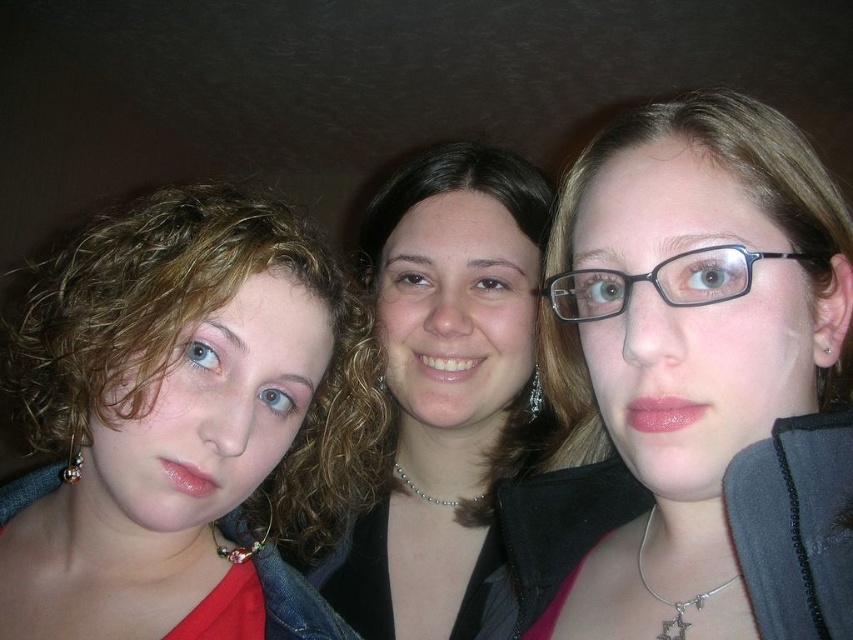
Question: Can you confirm if matte black glasses at center is positioned above black plastic glasses at center?

Choices:
 (A) no
 (B) yes

Answer: (A)

Question: Which object is positioned closest to the black plastic glasses at center?

Choices:
 (A) matte red shirt at left
 (B) matte black glasses at center

Answer: (B)

Question: Is matte black glasses at center positioned before matte red shirt at left?

Choices:
 (A) yes
 (B) no

Answer: (A)

Question: Considering the real-world distances, which object is closest to the matte black glasses at center?

Choices:
 (A) matte red shirt at left
 (B) smooth black jacket at center

Answer: (B)

Question: Which object is positioned farthest from the matte red shirt at left?

Choices:
 (A) black plastic glasses at center
 (B) matte black glasses at center
 (C) smooth black jacket at center

Answer: (A)

Question: Can you confirm if matte red shirt at left is positioned to the left of black plastic glasses at center?

Choices:
 (A) yes
 (B) no

Answer: (A)